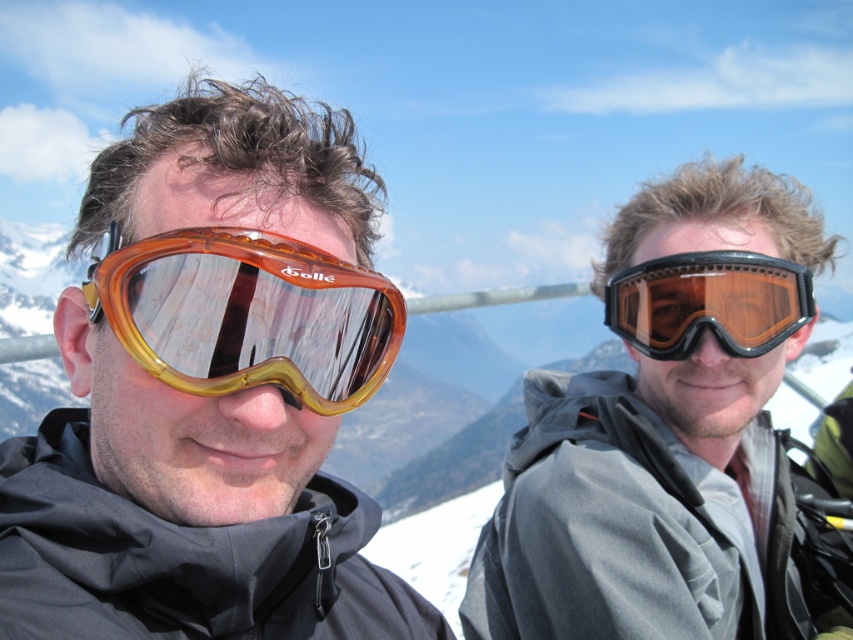
In the scene shown: Does matte black goggles at center appear over translucent amber plastic goggles at left?

Indeed, matte black goggles at center is positioned over translucent amber plastic goggles at left.

Does matte black goggles at center come in front of translucent amber plastic goggles at left?

No.

Find the location of `matte black goggles at center`. matte black goggles at center is located at coordinates (672, 440).

Where is `matte black goggles at center`? matte black goggles at center is located at coordinates (672, 440).

Is orange translucent goggles at center below translucent amber plastic goggles at left?

Incorrect, orange translucent goggles at center is not positioned below translucent amber plastic goggles at left.

Can you confirm if orange translucent goggles at center is taller than translucent amber plastic goggles at left?

Correct, orange translucent goggles at center is much taller as translucent amber plastic goggles at left.

In order to click on orange translucent goggles at center in this screenshot , I will do tap(212, 390).

Where is `orange translucent goggles at center`? Image resolution: width=853 pixels, height=640 pixels. orange translucent goggles at center is located at coordinates (212, 390).

Which of these two, matte black goggles at center or matte black goggles at right, stands shorter?

Standing shorter between the two is matte black goggles at right.

Which is in front, point (767, 253) or point (717, 339)?

Point (717, 339)

Where is `matte black goggles at center`? This screenshot has height=640, width=853. matte black goggles at center is located at coordinates (672, 440).